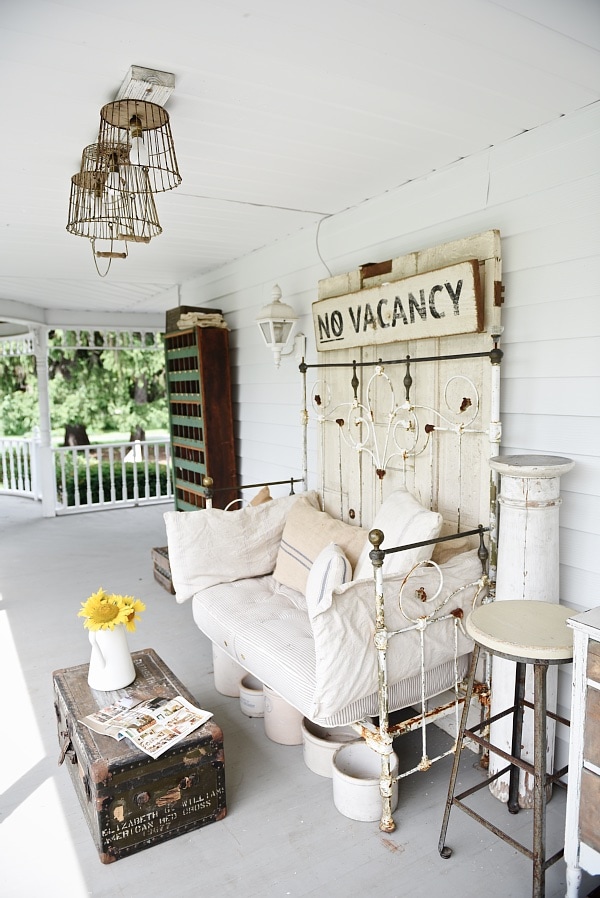
You are a GUI agent. You are given a task and a screenshot of the screen. Output one action in this format:
    pyautogui.click(x=<x>, y=<y>)
    Task: Click on the wooden sign
    
    Given the screenshot: What is the action you would take?
    pyautogui.click(x=410, y=310)